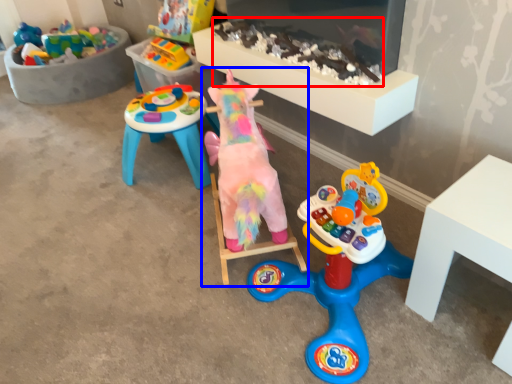
Question: Among these objects, which one is nearest to the camera, toy (highlighted by a red box) or toy (highlighted by a blue box)?

Choices:
 (A) toy
 (B) toy

Answer: (B)